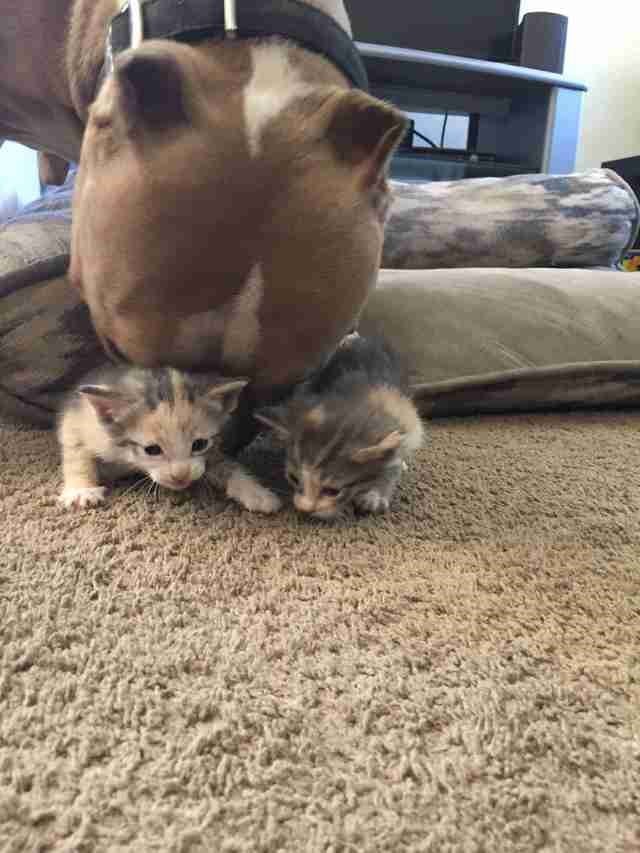
This screenshot has height=853, width=640. I want to click on pillow, so click(x=465, y=341).